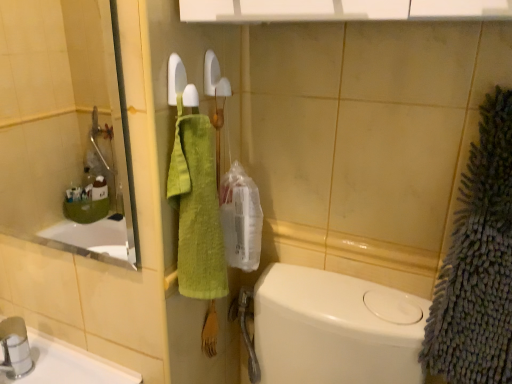
In order to face green cotton towel at center, which appears as the 2th bath towel when viewed from the right, should I rotate leftwards or rightwards?

Turn left approximately 5.810 degrees to face it.

You are a GUI agent. You are given a task and a screenshot of the screen. Output one action in this format:
    pyautogui.click(x=<x>, y=<y>)
    Task: Click on the clear glass mirror at upper left
    The height and width of the screenshot is (384, 512).
    Given the screenshot: What is the action you would take?
    pyautogui.click(x=65, y=129)

Locate an element on the screen. green cotton towel at center, which appears as the 2th bath towel when viewed from the right is located at coordinates (197, 210).

The height and width of the screenshot is (384, 512). I want to click on bath towel below the green cotton towel at center, which appears as the 2th bath towel when viewed from the right (from the image's perspective), so click(478, 263).

In the scene shown: In terms of height, does gray fuzzy bath towel at right, arranged as the first bath towel when viewed from the right, look taller or shorter compared to green cotton towel at center, the 1th bath towel in the left-to-right sequence?

In the image, gray fuzzy bath towel at right, arranged as the first bath towel when viewed from the right, appears to be taller than green cotton towel at center, the 1th bath towel in the left-to-right sequence.

Which is further, (448,330) or (210,172)?

Positioned behind is point (448,330).

From a real-world perspective, does gray fuzzy bath towel at right, arranged as the first bath towel when viewed from the right, sit lower than green cotton towel at center, which appears as the 2th bath towel when viewed from the right?

No, from a real-world perspective, gray fuzzy bath towel at right, arranged as the first bath towel when viewed from the right, is not beneath green cotton towel at center, which appears as the 2th bath towel when viewed from the right.

Based on the photo, considering the positions of objects clear glass mirror at upper left and gray fuzzy bath towel at right, which is counted as the 2th bath towel, starting from the left, in the image provided, who is more to the right, clear glass mirror at upper left or gray fuzzy bath towel at right, which is counted as the 2th bath towel, starting from the left,?

From the viewer's perspective, gray fuzzy bath towel at right, which is counted as the 2th bath towel, starting from the left, appears more on the right side.

Does point (5, 59) come farther from viewer compared to point (452, 326)?

Yes, it is behind point (452, 326).

Considering the relative sizes of clear glass mirror at upper left and gray fuzzy bath towel at right, arranged as the first bath towel when viewed from the right, in the image provided, is clear glass mirror at upper left thinner than gray fuzzy bath towel at right, arranged as the first bath towel when viewed from the right,?

Indeed, clear glass mirror at upper left has a lesser width compared to gray fuzzy bath towel at right, arranged as the first bath towel when viewed from the right.

Looking at this image, is clear glass mirror at upper left behind gray fuzzy bath towel at right, arranged as the first bath towel when viewed from the right?

Yes, the depth of clear glass mirror at upper left is greater than that of gray fuzzy bath towel at right, arranged as the first bath towel when viewed from the right.

In terms of height, does clear glass mirror at upper left look taller or shorter compared to green cotton towel at center, which appears as the 2th bath towel when viewed from the right?

clear glass mirror at upper left is shorter than green cotton towel at center, which appears as the 2th bath towel when viewed from the right.

Between clear glass mirror at upper left and green cotton towel at center, which appears as the 2th bath towel when viewed from the right, which one has smaller size?

green cotton towel at center, which appears as the 2th bath towel when viewed from the right, is smaller.

From the image's perspective, who appears lower, clear glass mirror at upper left or green cotton towel at center, which appears as the 2th bath towel when viewed from the right?

green cotton towel at center, which appears as the 2th bath towel when viewed from the right, appears lower in the image.

Considering the sizes of objects clear glass mirror at upper left and green cotton towel at center, the 1th bath towel in the left-to-right sequence, in the image provided, who is thinner, clear glass mirror at upper left or green cotton towel at center, the 1th bath towel in the left-to-right sequence,?

clear glass mirror at upper left.

Which is farther from the camera, (x=185, y=239) or (x=24, y=152)?

Point (x=24, y=152)

In the scene shown: In the image, is green cotton towel at center, the 1th bath towel in the left-to-right sequence, positioned in front of or behind clear glass mirror at upper left?

Visually, green cotton towel at center, the 1th bath towel in the left-to-right sequence, is located behind clear glass mirror at upper left.

From the image's perspective, which object appears higher, green cotton towel at center, the 1th bath towel in the left-to-right sequence, or clear glass mirror at upper left?

clear glass mirror at upper left appears higher in the image.

From the image's perspective, is green cotton towel at center, the 1th bath towel in the left-to-right sequence, positioned above or below gray fuzzy bath towel at right, arranged as the first bath towel when viewed from the right?

From the image's perspective, green cotton towel at center, the 1th bath towel in the left-to-right sequence, appears above gray fuzzy bath towel at right, arranged as the first bath towel when viewed from the right.

Locate an element on the screen. The width and height of the screenshot is (512, 384). bath towel that appears in front of the green cotton towel at center, which appears as the 2th bath towel when viewed from the right is located at coordinates (478, 263).

Is green cotton towel at center, the 1th bath towel in the left-to-right sequence, wider or thinner than gray fuzzy bath towel at right, arranged as the first bath towel when viewed from the right?

green cotton towel at center, the 1th bath towel in the left-to-right sequence, is thinner than gray fuzzy bath towel at right, arranged as the first bath towel when viewed from the right.

Does green cotton towel at center, which appears as the 2th bath towel when viewed from the right, have a lesser height compared to gray fuzzy bath towel at right, which is counted as the 2th bath towel, starting from the left?

Correct, green cotton towel at center, which appears as the 2th bath towel when viewed from the right, is not as tall as gray fuzzy bath towel at right, which is counted as the 2th bath towel, starting from the left.

In the scene shown: How many degrees apart are the facing directions of gray fuzzy bath towel at right, arranged as the first bath towel when viewed from the right, and clear glass mirror at upper left?

3.41 degrees separate the facing orientations of gray fuzzy bath towel at right, arranged as the first bath towel when viewed from the right, and clear glass mirror at upper left.

Is gray fuzzy bath towel at right, arranged as the first bath towel when viewed from the right, positioned far away from clear glass mirror at upper left?

Yes.

Does gray fuzzy bath towel at right, arranged as the first bath towel when viewed from the right, contain clear glass mirror at upper left?

No, clear glass mirror at upper left is not a part of gray fuzzy bath towel at right, arranged as the first bath towel when viewed from the right.

Considering the relative positions of gray fuzzy bath towel at right, which is counted as the 2th bath towel, starting from the left, and clear glass mirror at upper left in the image provided, is gray fuzzy bath towel at right, which is counted as the 2th bath towel, starting from the left, to the left or to the right of clear glass mirror at upper left?

gray fuzzy bath towel at right, which is counted as the 2th bath towel, starting from the left, is positioned on clear glass mirror at upper left's right side.

Locate an element on the screen. The height and width of the screenshot is (384, 512). bath towel behind the gray fuzzy bath towel at right, which is counted as the 2th bath towel, starting from the left is located at coordinates (197, 210).

You are a GUI agent. You are given a task and a screenshot of the screen. Output one action in this format:
    pyautogui.click(x=<x>, y=<y>)
    Task: Click on the bath towel in front of the clear glass mirror at upper left
    The image size is (512, 384).
    Given the screenshot: What is the action you would take?
    pyautogui.click(x=478, y=263)

When comparing their distances from gray fuzzy bath towel at right, which is counted as the 2th bath towel, starting from the left, does clear glass mirror at upper left or green cotton towel at center, which appears as the 2th bath towel when viewed from the right, seem further?

clear glass mirror at upper left lies further to gray fuzzy bath towel at right, which is counted as the 2th bath towel, starting from the left, than the other object.

Considering their positions, is green cotton towel at center, the 1th bath towel in the left-to-right sequence, positioned closer to gray fuzzy bath towel at right, arranged as the first bath towel when viewed from the right, than clear glass mirror at upper left?

Among the two, green cotton towel at center, the 1th bath towel in the left-to-right sequence, is located nearer to gray fuzzy bath towel at right, arranged as the first bath towel when viewed from the right.

Which object lies nearer to the anchor point clear glass mirror at upper left, green cotton towel at center, which appears as the 2th bath towel when viewed from the right, or gray fuzzy bath towel at right, which is counted as the 2th bath towel, starting from the left?

green cotton towel at center, which appears as the 2th bath towel when viewed from the right, is closer to clear glass mirror at upper left.

When comparing their distances from green cotton towel at center, the 1th bath towel in the left-to-right sequence, does gray fuzzy bath towel at right, which is counted as the 2th bath towel, starting from the left, or clear glass mirror at upper left seem closer?

gray fuzzy bath towel at right, which is counted as the 2th bath towel, starting from the left, lies closer to green cotton towel at center, the 1th bath towel in the left-to-right sequence, than the other object.

Considering their positions, is gray fuzzy bath towel at right, which is counted as the 2th bath towel, starting from the left, positioned further to clear glass mirror at upper left than green cotton towel at center, the 1th bath towel in the left-to-right sequence?

gray fuzzy bath towel at right, which is counted as the 2th bath towel, starting from the left, is positioned further to the anchor clear glass mirror at upper left.

In the scene shown: Which object lies further to the anchor point green cotton towel at center, the 1th bath towel in the left-to-right sequence, clear glass mirror at upper left or gray fuzzy bath towel at right, which is counted as the 2th bath towel, starting from the left?

The object further to green cotton towel at center, the 1th bath towel in the left-to-right sequence, is clear glass mirror at upper left.

Identify the location of bath towel between clear glass mirror at upper left and gray fuzzy bath towel at right, arranged as the first bath towel when viewed from the right. The width and height of the screenshot is (512, 384). (197, 210).